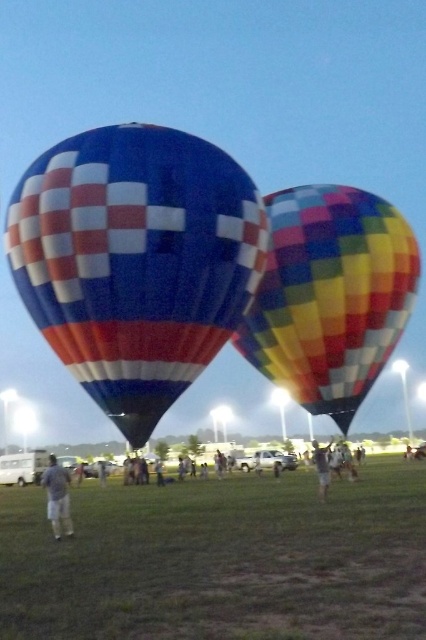
Identify the location of blue glossy hot air balloon at center. (135, 260).

Which is below, blue glossy hot air balloon at center or light blue fabric shirt at center?

Positioned lower is light blue fabric shirt at center.

Which is behind, point (40, 314) or point (157, 481)?

Point (157, 481)

I want to click on blue glossy hot air balloon at center, so click(135, 260).

Is multicolored checkered fabric hot air balloon at right bigger than denim shorts at center?

Actually, multicolored checkered fabric hot air balloon at right might be smaller than denim shorts at center.

Is multicolored checkered fabric hot air balloon at right below denim shorts at center?

Actually, multicolored checkered fabric hot air balloon at right is above denim shorts at center.

Does point (376, 260) lie in front of point (311, 456)?

Yes, it is.

At what (x,y) coordinates should I click in order to perform the action: click on multicolored checkered fabric hot air balloon at right. Please return your answer as a coordinate pair (x, y). The height and width of the screenshot is (640, 426). Looking at the image, I should click on (330, 296).

From the picture: Is gray fabric shorts at lower left thinner than denim shorts at center?

No, gray fabric shorts at lower left is not thinner than denim shorts at center.

Identify the location of gray fabric shorts at lower left. This screenshot has height=640, width=426. (57, 497).

Image resolution: width=426 pixels, height=640 pixels. In order to click on gray fabric shorts at lower left in this screenshot , I will do `click(57, 497)`.